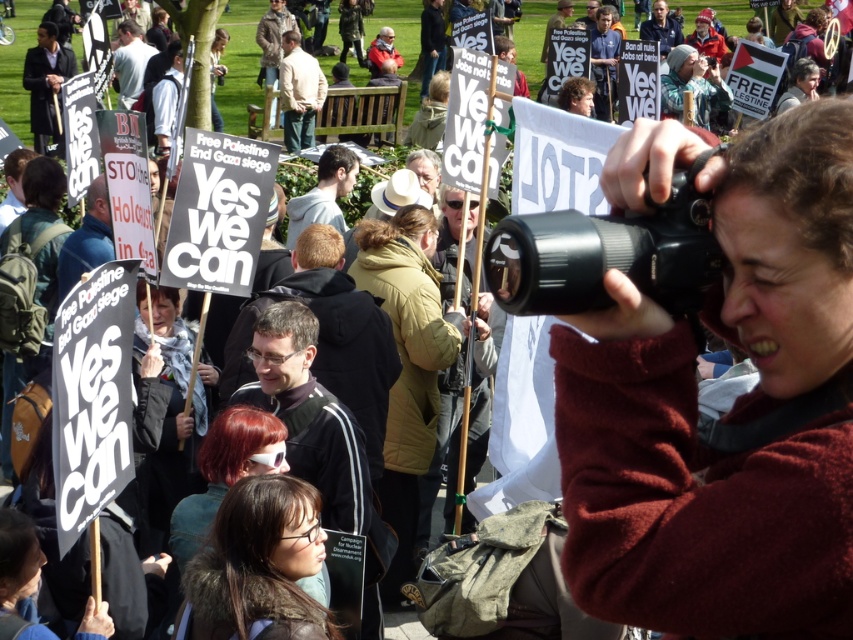
Based on the photo, who is more distant from viewer, (683,269) or (195,627)?

The point (195,627) is more distant.

Who is positioned more to the right, black plastic camera at upper right or dark brown hair at center?

From the viewer's perspective, black plastic camera at upper right appears more on the right side.

Identify the location of black plastic camera at upper right. (607, 253).

The height and width of the screenshot is (640, 853). I want to click on black plastic camera at upper right, so click(607, 253).

Is point (815, 211) closer to viewer compared to point (229, 524)?

That is True.

Which is in front, point (750, 288) or point (213, 556)?

Point (750, 288)

Locate an element on the screen. maroon fleece at center is located at coordinates (726, 413).

This screenshot has height=640, width=853. What do you see at coordinates (405, 365) in the screenshot? I see `green quilted jacket at center` at bounding box center [405, 365].

Does green quilted jacket at center have a larger size compared to dark brown hair at center?

Yes.

Where is `green quilted jacket at center`? green quilted jacket at center is located at coordinates 405,365.